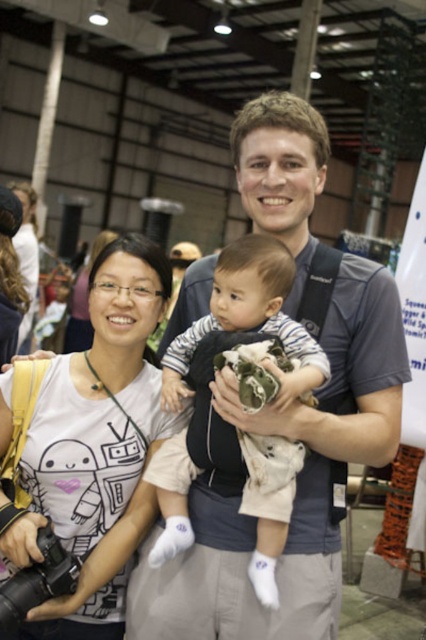
Which is below, matte gray shirt at center or white matte t-shirt at center?

white matte t-shirt at center

Does point (293, 305) come in front of point (143, 515)?

Yes, point (293, 305) is in front of point (143, 515).

Locate an element on the screen. This screenshot has height=640, width=426. matte gray shirt at center is located at coordinates (290, 404).

Is point (115, 524) positioned in front of point (327, 372)?

No, (115, 524) is further to viewer.

Is white matte t-shirt at center smaller than white cotton baby at center?

No.

Between point (57, 435) and point (284, 384), which one is positioned behind?

Point (57, 435)

I want to click on white matte t-shirt at center, so click(x=97, y=445).

This screenshot has height=640, width=426. What do you see at coordinates (97, 445) in the screenshot? I see `white matte t-shirt at center` at bounding box center [97, 445].

Measure the distance between white matte t-shirt at center and black plastic camera at lower left.

A distance of 8.66 inches exists between white matte t-shirt at center and black plastic camera at lower left.

This screenshot has height=640, width=426. In order to click on white matte t-shirt at center in this screenshot , I will do `click(97, 445)`.

This screenshot has width=426, height=640. What are the coordinates of `white matte t-shirt at center` in the screenshot? It's located at (97, 445).